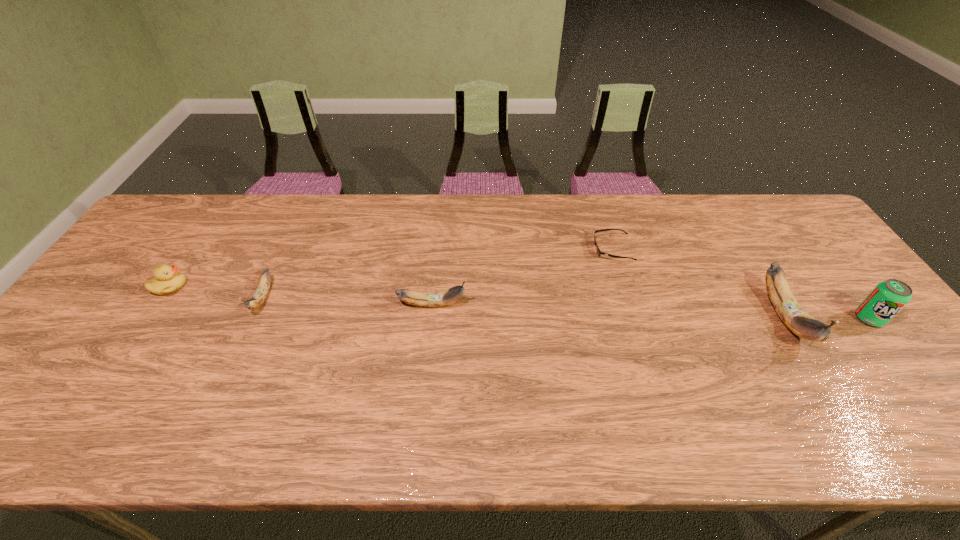
The width and height of the screenshot is (960, 540). I want to click on object that is the third closest to the fourth object from right to left, so click(167, 280).

Image resolution: width=960 pixels, height=540 pixels. Identify the location of banana identified as the second closest to the tallest banana. coord(260,294).

Where is `banana object that ranks as the third closest to the rightmost object`? banana object that ranks as the third closest to the rightmost object is located at coordinates (x=260, y=294).

This screenshot has width=960, height=540. Find the location of `free space that satisfies the following two spatial constraints: 1. on the front-facing side of the shortest object; 2. on the peel of the shortest banana`. free space that satisfies the following two spatial constraints: 1. on the front-facing side of the shortest object; 2. on the peel of the shortest banana is located at coordinates (628, 298).